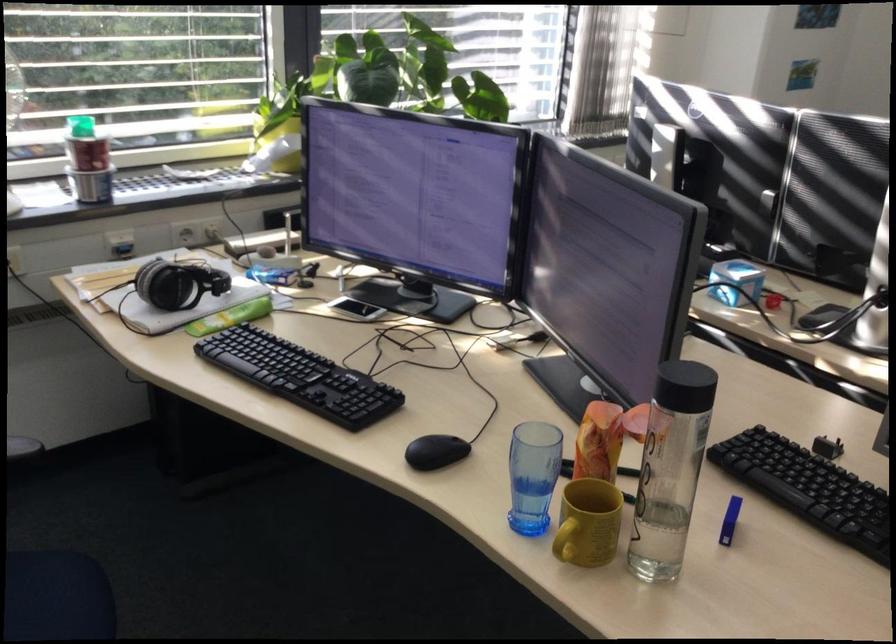
I want to click on clear water bottle, so click(670, 468).